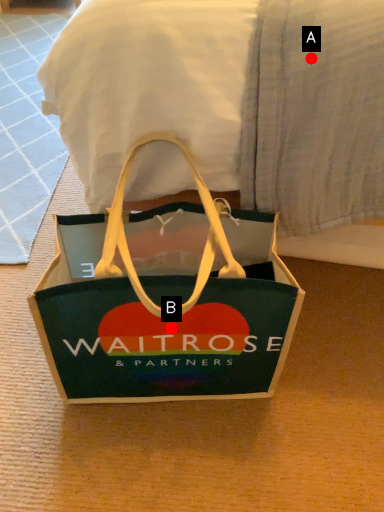
Question: Two points are circled on the image, labeled by A and B beside each circle. Which point is further to the camera?

Choices:
 (A) A is further
 (B) B is further

Answer: (B)